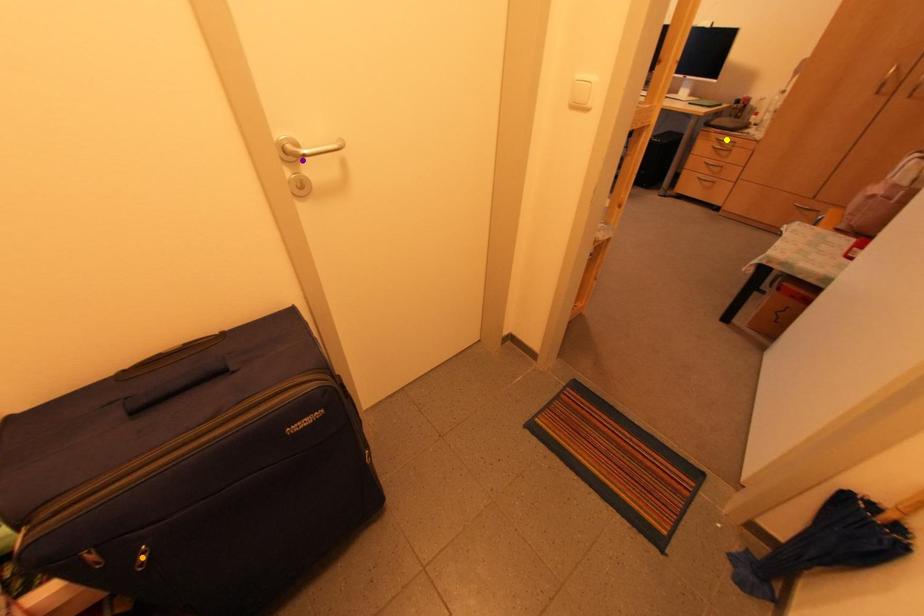
Order these from nearest to farthest:
yellow point, purple point, orange point

orange point
purple point
yellow point